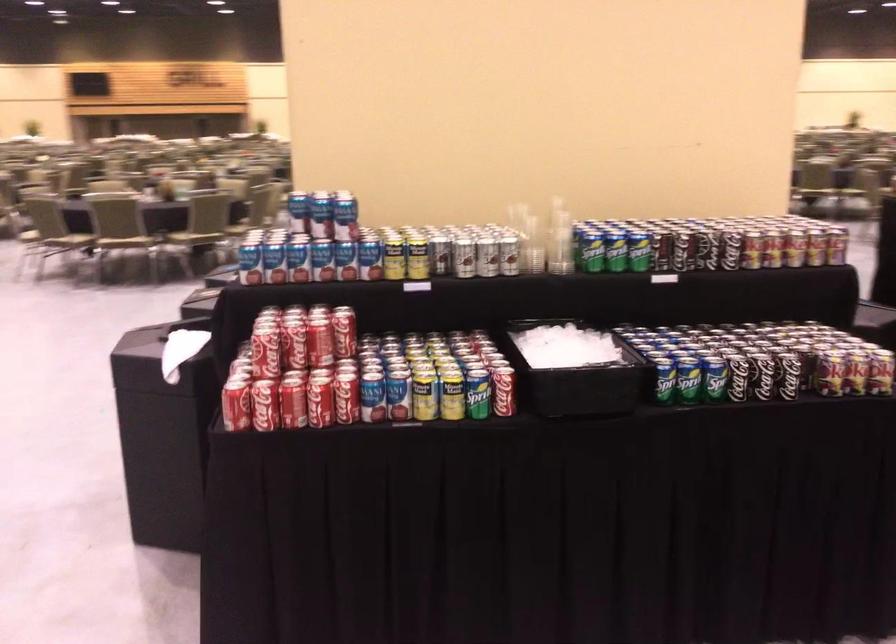
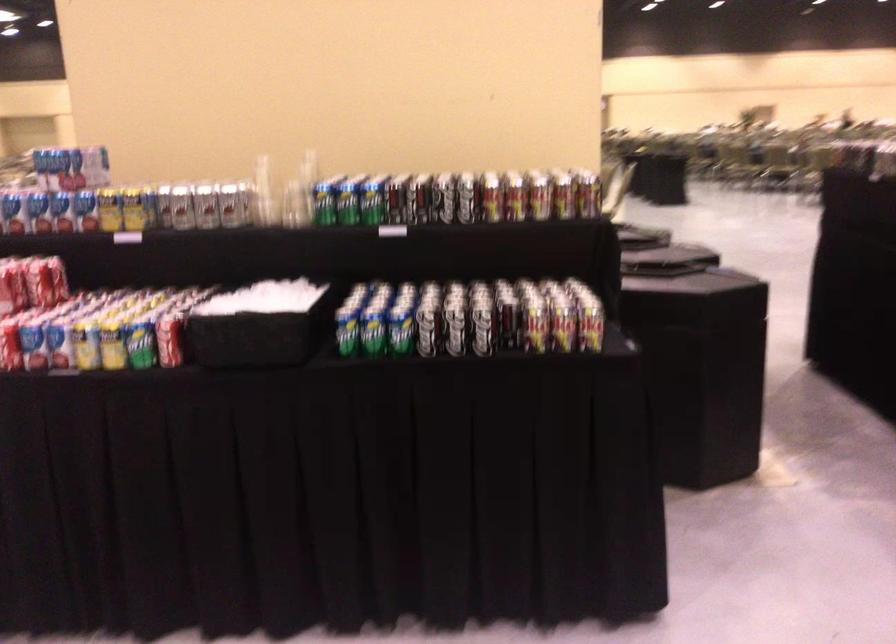
Where in the second image is the point corresponding to the point at 495,393 from the first image?

(169, 339)